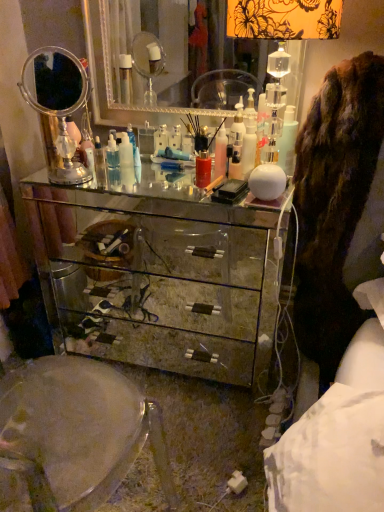
Question: Is brown furry coat at right at the left side of translucent plastic bottle at center, which ranks as the second toiletry in back-to-front order?

Choices:
 (A) no
 (B) yes

Answer: (A)

Question: Is brown furry coat at right shorter than translucent plastic bottle at center, acting as the first toiletry starting from the front?

Choices:
 (A) no
 (B) yes

Answer: (A)

Question: Can you confirm if brown furry coat at right is wider than translucent plastic bottle at center, acting as the first toiletry starting from the front?

Choices:
 (A) yes
 (B) no

Answer: (A)

Question: From the image's perspective, is brown furry coat at right on translucent plastic bottle at center, acting as the first toiletry starting from the front?

Choices:
 (A) no
 (B) yes

Answer: (A)

Question: Is brown furry coat at right further to the viewer compared to translucent plastic bottle at center, the 2th toiletry when ordered from left to right?

Choices:
 (A) yes
 (B) no

Answer: (B)

Question: Is point (248, 157) closer or farther from the camera than point (225, 42)?

Choices:
 (A) farther
 (B) closer

Answer: (B)

Question: Is translucent plastic bottle at center, which ranks as the second toiletry in back-to-front order, wider or thinner than silver mirrored dresser at center, the 1th mirror viewed from the right?

Choices:
 (A) thin
 (B) wide

Answer: (A)

Question: Is translucent plastic bottle at center, acting as the first toiletry starting from the front, in front of or behind silver mirrored dresser at center, the 2th mirror from the left, in the image?

Choices:
 (A) front
 (B) behind

Answer: (A)

Question: From a real-world perspective, is translucent plastic bottle at center, placed as the first toiletry when sorted from right to left, above or below silver mirrored dresser at center, the 2th mirror from the left?

Choices:
 (A) below
 (B) above

Answer: (A)

Question: From the image's perspective, is silver mirrored dresser at center, the 1th mirror viewed from the right, located above or below mirrored glass chest of drawers at center?

Choices:
 (A) above
 (B) below

Answer: (A)

Question: Does point (94, 42) appear closer or farther from the camera than point (92, 292)?

Choices:
 (A) farther
 (B) closer

Answer: (B)

Question: Relative to mirrored glass chest of drawers at center, is silver mirrored dresser at center, the 1th mirror viewed from the right, in front or behind?

Choices:
 (A) front
 (B) behind

Answer: (B)

Question: Is silver mirrored dresser at center, the 1th mirror viewed from the right, situated inside mirrored glass chest of drawers at center or outside?

Choices:
 (A) inside
 (B) outside

Answer: (B)

Question: From their relative heights in the image, would you say silver mirrored dresser at center, the 2th mirror from the left, is taller or shorter than translucent plastic bottle at center, which ranks as the second toiletry in back-to-front order?

Choices:
 (A) short
 (B) tall

Answer: (B)

Question: Is silver mirrored dresser at center, the 1th mirror viewed from the right, inside the boundaries of translucent plastic bottle at center, which ranks as the second toiletry in back-to-front order, or outside?

Choices:
 (A) inside
 (B) outside

Answer: (B)